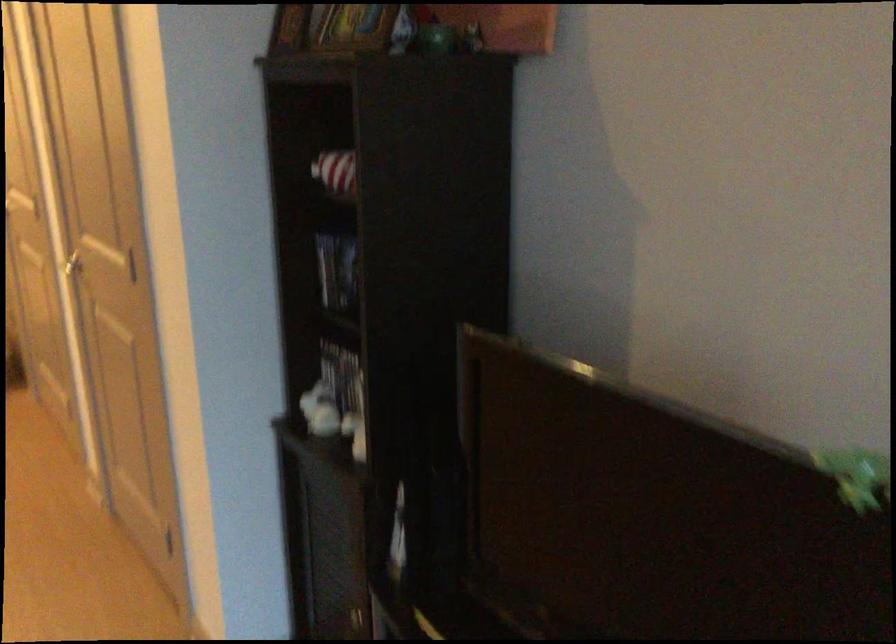
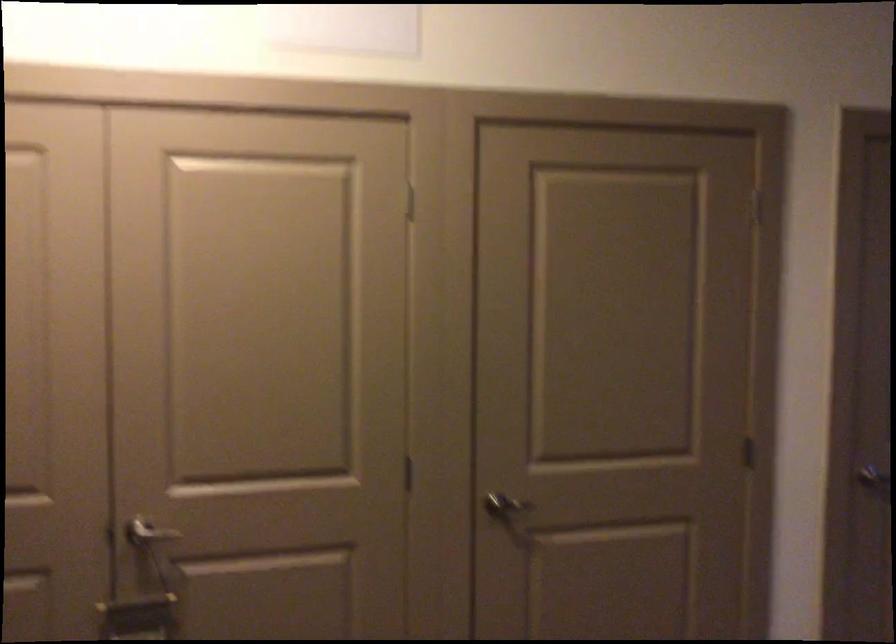
The point at (99, 283) is marked in the first image. Where is the corresponding point in the second image?

(853, 476)